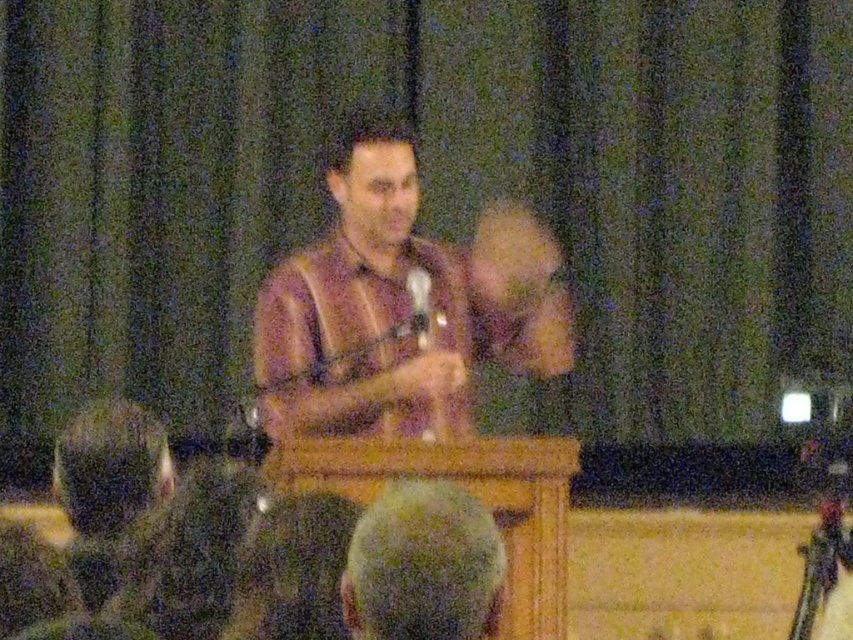
You are an event organizer checking the stage setup. You need to ensure that the dark green fabric at lower center and the translucent plastic microphone at center are positioned correctly. What can you infer about their sizes based on the current setup?

The dark green fabric at lower center is bigger than the translucent plastic microphone at center, so it occupies more space in the scene.

Consider the image. You are standing at the back of the auditorium and want to see the speaker clearly. There are two points marked in the scene. Which point is closer to the speaker, point (260, 552) or point (424, 276)?

Point (260, 552) is closer to the speaker because it is in front of point (424, 276).

You are an event organizer planning to set up a camera to capture the speaker and the audience. The camera needs to have a clear view of both the matte brown shirt at center and the dark green fabric at lower center. Based on their positions, will the camera be able to capture both without any obstruction?

The dark green fabric at lower center is behind the matte brown shirt at center, so the camera might have difficulty capturing both clearly because the matte brown shirt at center could block the view of the dark green fabric at lower center.